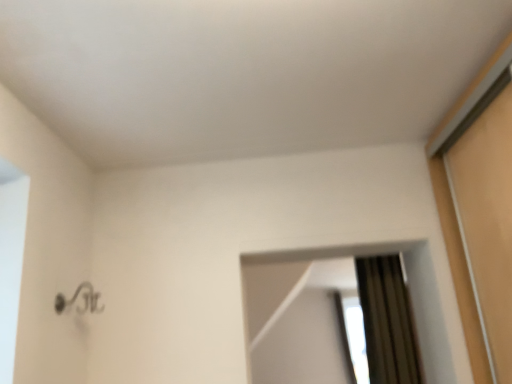
In order to click on transparent glass window at upper right in this screenshot , I will do `click(352, 337)`.

Describe the element at coordinates (352, 337) in the screenshot. I see `transparent glass window at upper right` at that location.

What is the approximate height of matte brown mirror at right?

matte brown mirror at right is 25.24 inches in height.

What do you see at coordinates (300, 311) in the screenshot? The image size is (512, 384). I see `matte brown mirror at right` at bounding box center [300, 311].

This screenshot has width=512, height=384. I want to click on matte brown mirror at right, so click(300, 311).

Where is `transparent glass window at upper right`? The height and width of the screenshot is (384, 512). transparent glass window at upper right is located at coordinates (352, 337).

Does transparent glass window at upper right appear on the right side of matte brown mirror at right?

Indeed, transparent glass window at upper right is positioned on the right side of matte brown mirror at right.

Is transparent glass window at upper right positioned before matte brown mirror at right?

No.

Which is in front, point (350, 378) or point (319, 285)?

The point (350, 378) is closer to the camera.

Consider the image. From the image's perspective, between transparent glass window at upper right and matte brown mirror at right, which one is located above?

matte brown mirror at right, from the image's perspective.

From a real-world perspective, is transparent glass window at upper right positioned above or below matte brown mirror at right?

transparent glass window at upper right is situated lower than matte brown mirror at right in the real world.

Considering the sizes of objects transparent glass window at upper right and matte brown mirror at right in the image provided, who is wider, transparent glass window at upper right or matte brown mirror at right?

transparent glass window at upper right is wider.

Between transparent glass window at upper right and matte brown mirror at right, which one has less height?

matte brown mirror at right is shorter.

Looking at this image, based on their sizes in the image, would you say transparent glass window at upper right is bigger or smaller than matte brown mirror at right?

Clearly, transparent glass window at upper right is larger in size than matte brown mirror at right.

From the picture: Is matte brown mirror at right completely or partially inside transparent glass window at upper right?

No, matte brown mirror at right is not a part of transparent glass window at upper right.

Can you see transparent glass window at upper right touching matte brown mirror at right?

transparent glass window at upper right and matte brown mirror at right are not in contact.

Is matte brown mirror at right at the back of transparent glass window at upper right?

transparent glass window at upper right does not have its back to matte brown mirror at right.

Where is `mirror above the transparent glass window at upper right (from the image's perspective)`? mirror above the transparent glass window at upper right (from the image's perspective) is located at coordinates (300, 311).

Is matte brown mirror at right to the left of transparent glass window at upper right from the viewer's perspective?

Correct, you'll find matte brown mirror at right to the left of transparent glass window at upper right.

Considering their positions, is matte brown mirror at right located in front of or behind transparent glass window at upper right?

matte brown mirror at right is in front of transparent glass window at upper right.

Considering the positions of point (313, 271) and point (342, 311), is point (313, 271) closer or farther from the camera than point (342, 311)?

Point (313, 271) is closer to the camera than point (342, 311).

From the image's perspective, is matte brown mirror at right on top of transparent glass window at upper right?

Yes.

From a real-world perspective, relative to transparent glass window at upper right, is matte brown mirror at right vertically above or below?

From a real-world perspective, matte brown mirror at right is physically above transparent glass window at upper right.

Which object is thinner, matte brown mirror at right or transparent glass window at upper right?

matte brown mirror at right is thinner.

Considering the sizes of matte brown mirror at right and transparent glass window at upper right in the image, is matte brown mirror at right taller or shorter than transparent glass window at upper right?

Clearly, matte brown mirror at right is shorter compared to transparent glass window at upper right.

Between matte brown mirror at right and transparent glass window at upper right, which one has smaller size?

matte brown mirror at right is smaller.

Is matte brown mirror at right not within transparent glass window at upper right?

Yes, matte brown mirror at right is not within transparent glass window at upper right.

Is matte brown mirror at right far from transparent glass window at upper right?

matte brown mirror at right is actually quite close to transparent glass window at upper right.

Is matte brown mirror at right aimed at transparent glass window at upper right?

Yes, matte brown mirror at right faces towards transparent glass window at upper right.

How different are the orientations of matte brown mirror at right and transparent glass window at upper right in degrees?

The angular difference between matte brown mirror at right and transparent glass window at upper right is 176 degrees.

Image resolution: width=512 pixels, height=384 pixels. I want to click on window behind the matte brown mirror at right, so click(352, 337).

Find the location of a particular element. mirror in front of the transparent glass window at upper right is located at coordinates (300, 311).

Where is `window lying below the matte brown mirror at right (from the image's perspective)`? window lying below the matte brown mirror at right (from the image's perspective) is located at coordinates (352, 337).